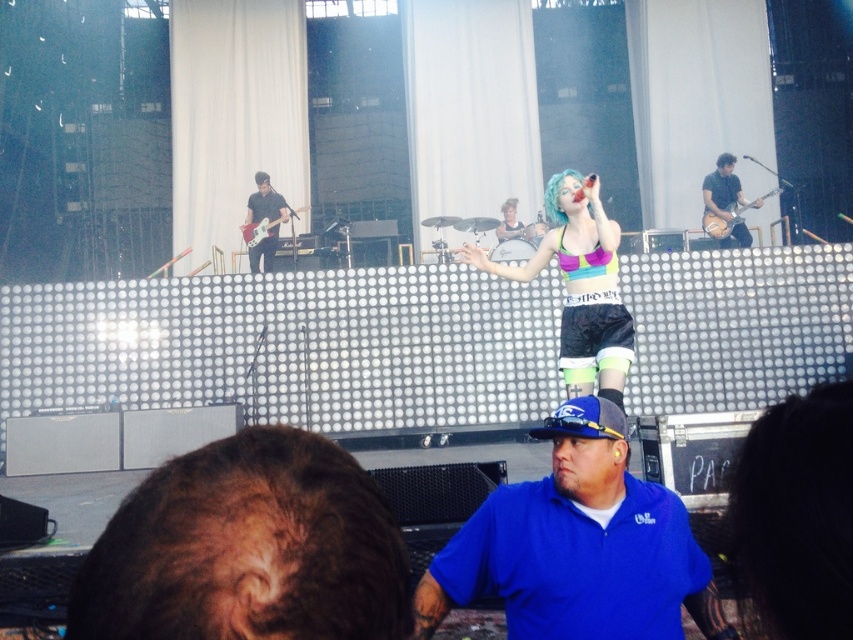
Between matte black guitar at left and shiny silver guitar at center, which one appears on the left side from the viewer's perspective?

Positioned to the left is matte black guitar at left.

Describe the element at coordinates (265, 202) in the screenshot. I see `matte black guitar at left` at that location.

The image size is (853, 640). What do you see at coordinates (265, 202) in the screenshot?
I see `matte black guitar at left` at bounding box center [265, 202].

Locate an element on the screen. The height and width of the screenshot is (640, 853). matte black guitar at left is located at coordinates (265, 202).

Looking at this image, is shiny black guitar at upper right bigger than light brown wood electric guitar at upper right?

Correct, shiny black guitar at upper right is larger in size than light brown wood electric guitar at upper right.

Who is more distant from viewer, (x=715, y=173) or (x=730, y=211)?

The point (x=715, y=173) is behind.

Identify the location of shiny black guitar at upper right. The image size is (853, 640). (726, 200).

Between blue fabric shirt at lower center and shiny silver guitar at center, which one appears on the left side from the viewer's perspective?

Positioned to the left is blue fabric shirt at lower center.

Which of these two, blue fabric shirt at lower center or shiny silver guitar at center, stands shorter?

With less height is shiny silver guitar at center.

Image resolution: width=853 pixels, height=640 pixels. Find the location of `blue fabric shirt at lower center`. blue fabric shirt at lower center is located at coordinates (578, 547).

You are a GUI agent. You are given a task and a screenshot of the screen. Output one action in this format:
    pyautogui.click(x=<x>, y=<y>)
    Task: Click on the blue fabric shirt at lower center
    This screenshot has height=640, width=853.
    Given the screenshot: What is the action you would take?
    pyautogui.click(x=578, y=547)